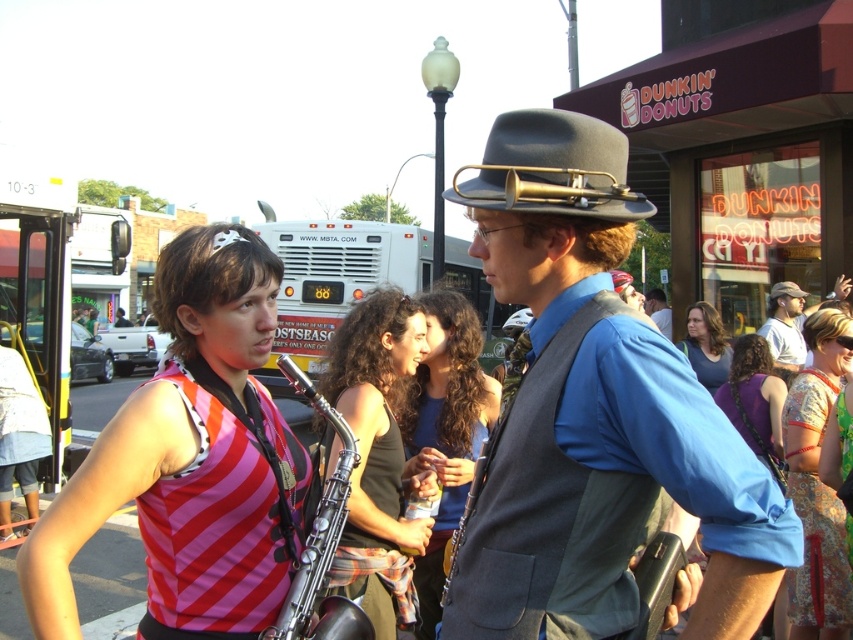
You are a photographer trying to capture a clear shot of the silver metallic saxophone at center and the matte blue shirt at center. Which object should you focus on first to ensure it appears sharp in the photo?

The silver metallic saxophone at center is in front of the matte blue shirt at center, so you should focus on the silver metallic saxophone at center first to ensure it appears sharp in the photo.

Looking at this image, you are a photographer standing near the camera. You want to take a photo of the matte green shirt at center without moving the shirt. Can you adjust your position to get the shot within the camera frame?

The matte green shirt at center and camera are 9.51 feet apart from each other. Since the distance is within the camera frame range, you can adjust your position to capture the matte green shirt at center in the shot.

You are a photographer trying to capture both the silver metallic saxophone at center and the matte blue shirt at center in a single frame. Which object should you focus on first to ensure both are in the frame without cropping?

The silver metallic saxophone at center is taller than the matte blue shirt at center, so you should focus on the taller saxophone first to ensure it fits within the frame, allowing the shorter shirt to also be captured without cropping.